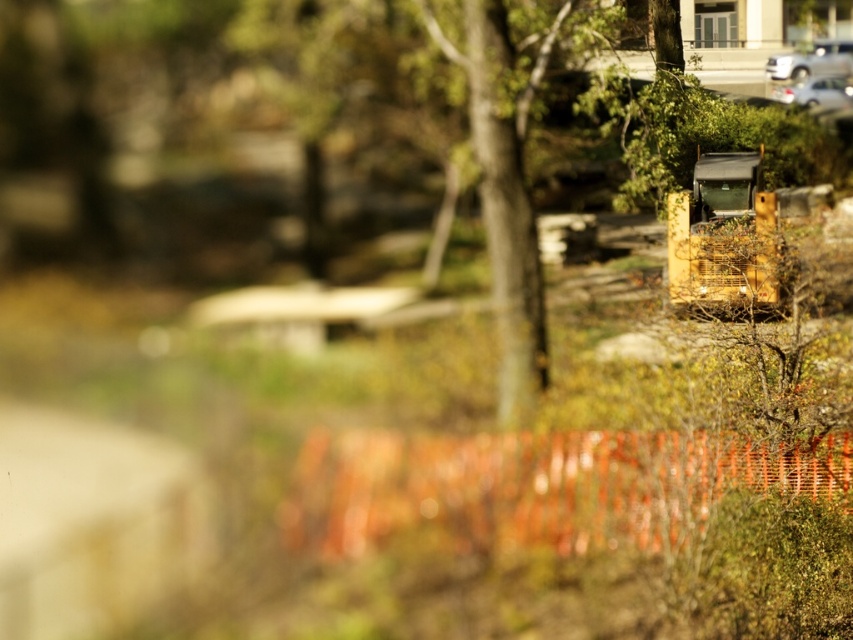
Question: Based on their relative distances, which object is farther from the silver metallic car at upper right?

Choices:
 (A) green leafy tree at center
 (B) metallic silver car at upper right

Answer: (A)

Question: Does green leafy tree at center have a larger size compared to metallic silver car at upper right?

Choices:
 (A) no
 (B) yes

Answer: (B)

Question: Among these objects, which one is farthest from the camera?

Choices:
 (A) silver metallic car at upper right
 (B) green leafy tree at center
 (C) metallic silver car at upper right

Answer: (C)

Question: Is green leafy tree at center positioned before silver metallic car at upper right?

Choices:
 (A) yes
 (B) no

Answer: (A)

Question: Which object appears closest to the camera in this image?

Choices:
 (A) silver metallic car at upper right
 (B) metallic silver car at upper right
 (C) green leafy tree at center

Answer: (C)

Question: From the image, what is the correct spatial relationship of metallic silver car at upper right in relation to silver metallic car at upper right?

Choices:
 (A) right
 (B) left

Answer: (B)